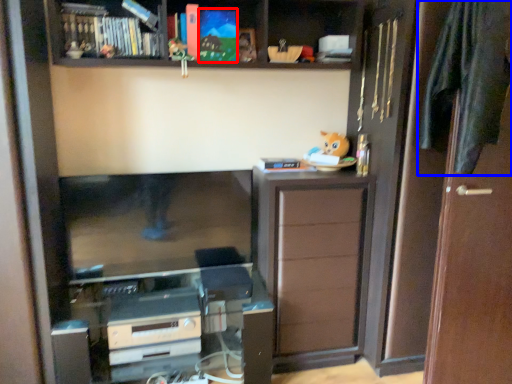
Question: Which object appears farthest to the camera in this image, book (highlighted by a red box) or clothe (highlighted by a blue box)?

Choices:
 (A) book
 (B) clothe

Answer: (A)